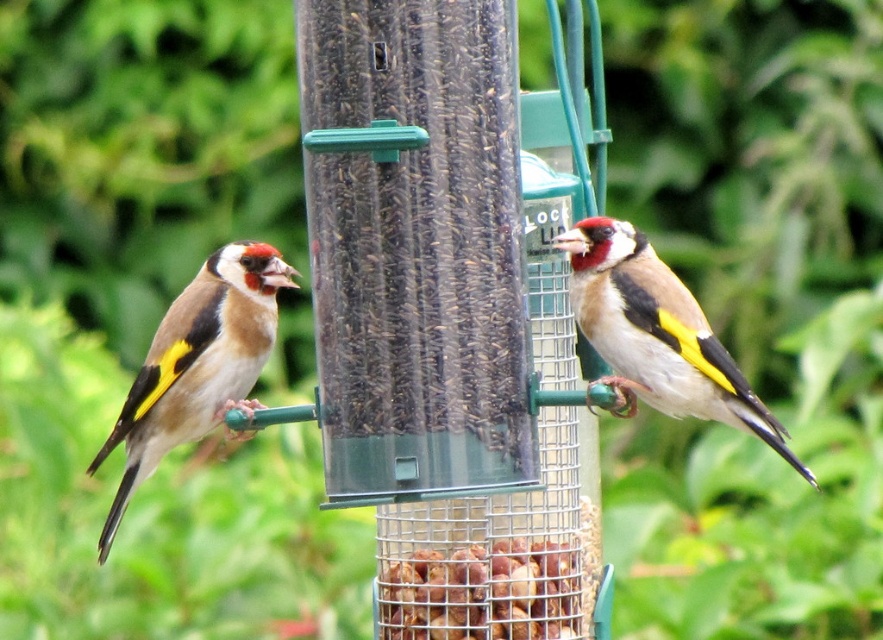
Can you confirm if yellow-black speckled bird at right is taller than brown textured nuts at center?

Indeed, yellow-black speckled bird at right has a greater height compared to brown textured nuts at center.

Does yellow-black speckled bird at right have a larger size compared to brown textured nuts at center?

Indeed, yellow-black speckled bird at right has a larger size compared to brown textured nuts at center.

Find the location of `yellow-black speckled bird at right`. yellow-black speckled bird at right is located at coordinates (657, 333).

The height and width of the screenshot is (640, 883). I want to click on yellow-black speckled bird at right, so click(x=657, y=333).

Is yellow-black speckled bird at right above golden-yellow feathers at left?

Indeed, yellow-black speckled bird at right is positioned over golden-yellow feathers at left.

Between yellow-black speckled bird at right and golden-yellow feathers at left, which one has more height?

With more height is golden-yellow feathers at left.

This screenshot has height=640, width=883. I want to click on yellow-black speckled bird at right, so 657,333.

This screenshot has height=640, width=883. What are the coordinates of `yellow-black speckled bird at right` in the screenshot? It's located at (657, 333).

Does golden-yellow feathers at left have a greater width compared to brown textured nuts at center?

Yes.

Locate an element on the screen. golden-yellow feathers at left is located at coordinates (197, 364).